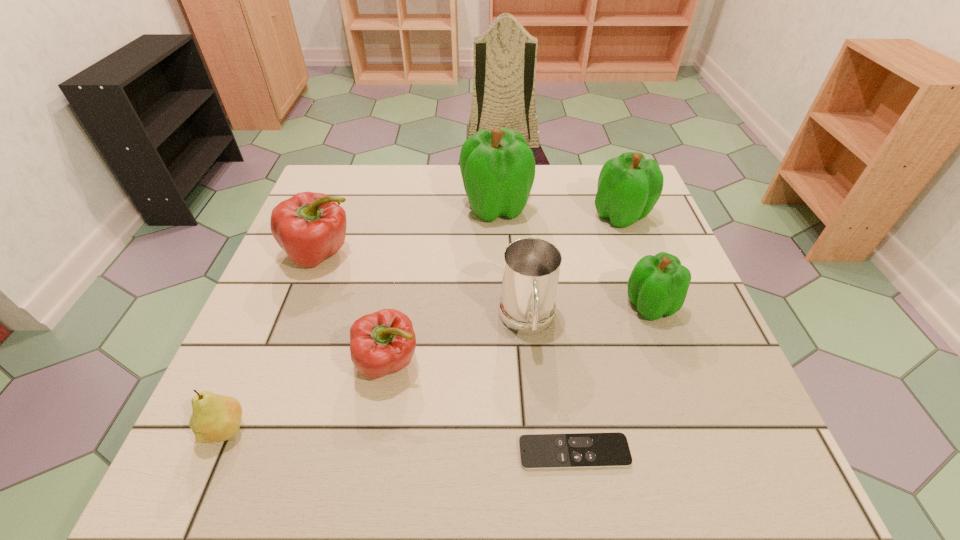
The image size is (960, 540). In order to click on the tallest object in this screenshot , I will do `click(498, 168)`.

Find the location of a particular element. The width and height of the screenshot is (960, 540). the third bell pepper from left to right is located at coordinates (498, 168).

The image size is (960, 540). I want to click on the second smallest green bell pepper, so click(x=629, y=186).

Find the location of a particular element. This screenshot has width=960, height=540. the bigger pink bell pepper is located at coordinates (310, 227).

Where is `the farther pink bell pepper`? Image resolution: width=960 pixels, height=540 pixels. the farther pink bell pepper is located at coordinates (310, 227).

The width and height of the screenshot is (960, 540). In order to click on gray mug in this screenshot , I will do `click(531, 266)`.

This screenshot has width=960, height=540. Identify the location of the smallest green bell pepper. (658, 285).

At what (x,y) coordinates should I click in order to perform the action: click on the nearest green bell pepper. Please return your answer as a coordinate pair (x, y). This screenshot has width=960, height=540. Looking at the image, I should click on (658, 285).

The width and height of the screenshot is (960, 540). I want to click on the third object from left to right, so click(x=381, y=343).

Locate an element on the screen. the smaller pink bell pepper is located at coordinates (381, 343).